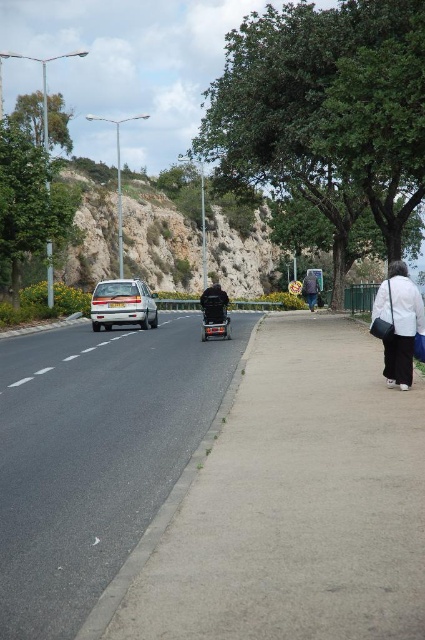
Question: Does shiny black motorcycle at center have a smaller size compared to white cotton shirt at center?

Choices:
 (A) yes
 (B) no

Answer: (A)

Question: Which of the following is the closest to the observer?

Choices:
 (A) silver metallic sedan at center-left
 (B) gray asphalt sidewalk at center

Answer: (B)

Question: Can you confirm if silver metallic sedan at center-left is positioned below white cotton shirt at center?

Choices:
 (A) no
 (B) yes

Answer: (B)

Question: Is silver metallic sedan at center-left positioned behind white cotton shirt at center?

Choices:
 (A) no
 (B) yes

Answer: (A)

Question: Which point is farther from the camera taking this photo?

Choices:
 (A) (207, 296)
 (B) (413, 317)
 (C) (207, 307)

Answer: (C)

Question: Which point is closer to the camera?

Choices:
 (A) (387, 376)
 (B) (337, 316)
 (C) (224, 305)

Answer: (A)